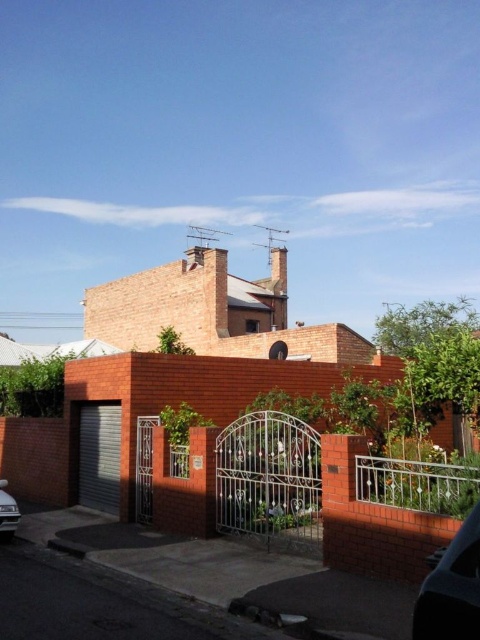
You are standing at the center of the image. Which direction should you move to reach the shiny black car at lower right?

Since the shiny black car at lower right is located at coordinates approximately 0.920 on the x and 0.942 on the y axis, you should move towards the lower right direction to reach it.

You are a delivery person arriving at the house and need to park your van between the shiny black car at lower right and the shiny silver car at lower left. Can you fit your van, which is 6 meters long, in the available space between them?

The shiny black car at lower right is smaller than the shiny silver car at lower left. However, the exact distance between them isn not provided in the description. Without knowing the space between the two cars, it is impossible to determine if the van can fit.